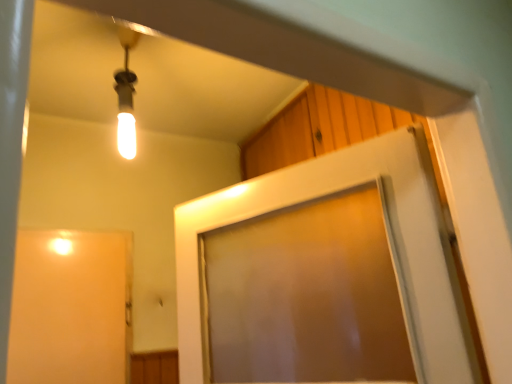
The height and width of the screenshot is (384, 512). Describe the element at coordinates (126, 96) in the screenshot. I see `matte glass bulb at upper left` at that location.

The image size is (512, 384). What are the coordinates of `matte glass bulb at upper left` in the screenshot? It's located at (126, 96).

Where is `matte glass bulb at upper left`? This screenshot has height=384, width=512. matte glass bulb at upper left is located at coordinates (126, 96).